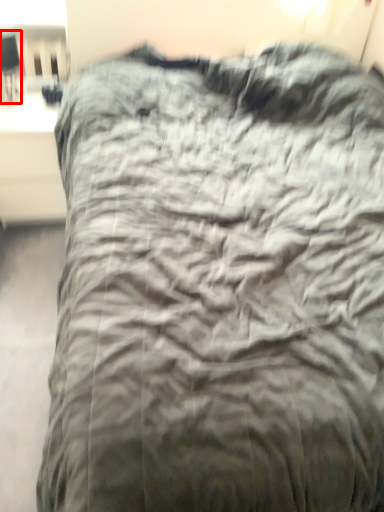
Question: From the image's perspective, considering the relative positions of table lamp (annotated by the red box) and table in the image provided, where is table lamp (annotated by the red box) located with respect to the staircase?

Choices:
 (A) above
 (B) below

Answer: (A)